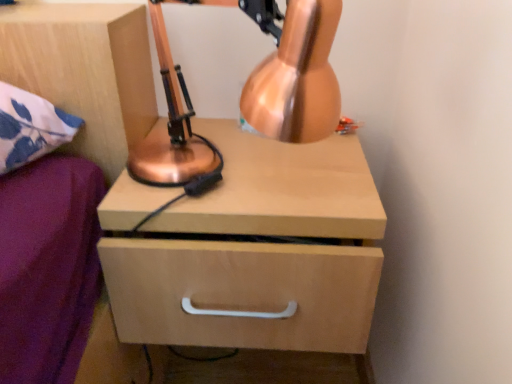
You are a GUI agent. You are given a task and a screenshot of the screen. Output one action in this format:
    pyautogui.click(x=<x>, y=<y>)
    Task: Click on the light wood drawer at center
    The height and width of the screenshot is (384, 512).
    Given the screenshot: What is the action you would take?
    pyautogui.click(x=241, y=293)

What do you see at coordinates (241, 293) in the screenshot? The image size is (512, 384). I see `light wood drawer at center` at bounding box center [241, 293].

Locate an element on the screen. The image size is (512, 384). light wood drawer at center is located at coordinates (241, 293).